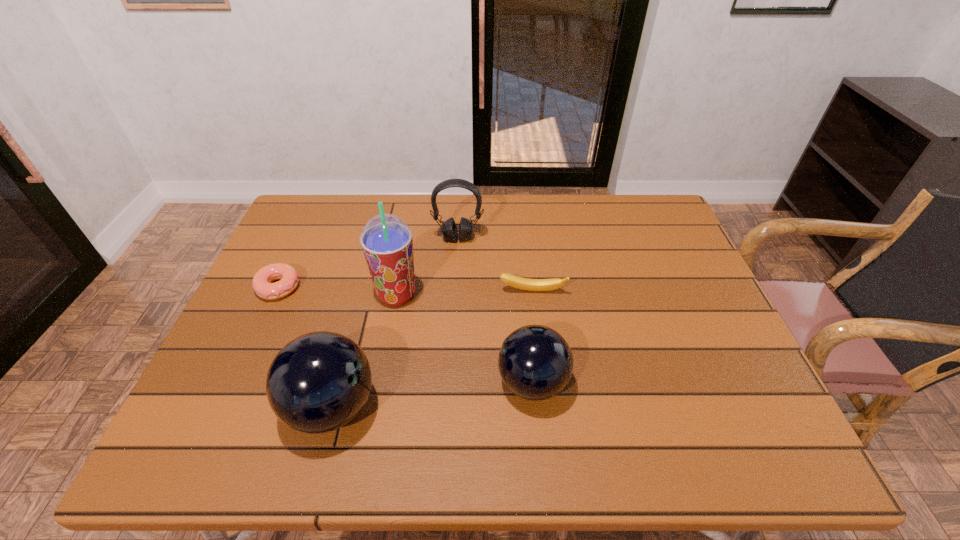
Considering the uniform spacing of bowling balls, where should an additional bowling ball be positioned on the right? Please locate a free spot. Please provide its 2D coordinates. Your answer should be formatted as a tuple, i.e. [(x, y)], where the tuple contains the x and y coordinates of a point satisfying the conditions above.

[(716, 361)]